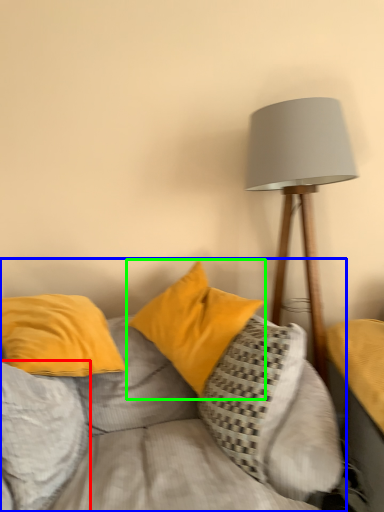
Question: Based on their relative distances, which object is farther from pillow (highlighted by a red box)? Choose from studio couch (highlighted by a blue box) and pillow (highlighted by a green box).

Choices:
 (A) studio couch
 (B) pillow

Answer: (B)